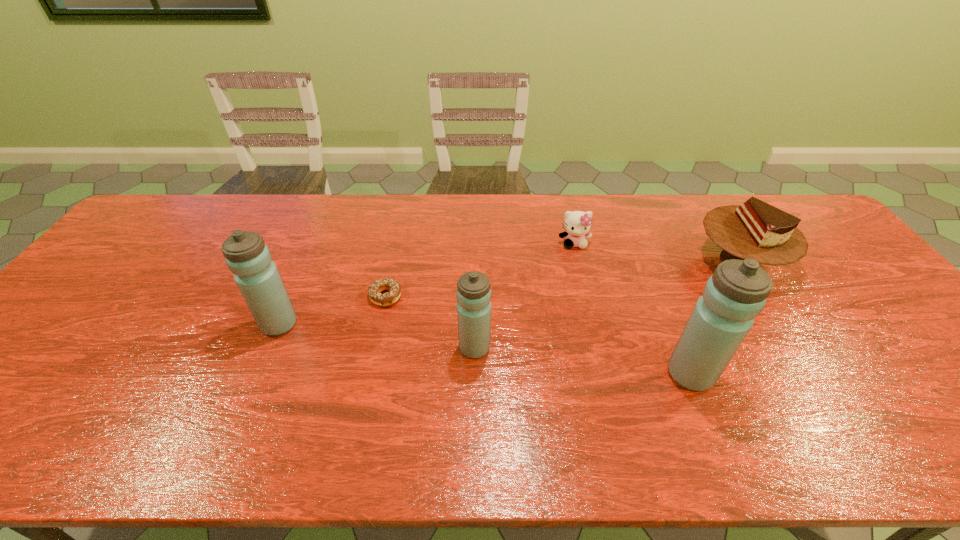
Locate an element on the screen. free space at the far edge is located at coordinates (255, 227).

Where is `free location at the near edge of the desktop`? free location at the near edge of the desktop is located at coordinates (603, 396).

Locate an element on the screen. This screenshot has height=540, width=960. free region at the left edge of the desktop is located at coordinates (114, 307).

Where is `free space at the right edge of the desktop`? This screenshot has width=960, height=540. free space at the right edge of the desktop is located at coordinates (886, 303).

Locate an element on the screen. vacant space at the far left corner of the desktop is located at coordinates (138, 228).

You are a GUI agent. You are given a task and a screenshot of the screen. Output one action in this format:
    pyautogui.click(x=<x>, y=<y>)
    Task: Click on the unoccupied position between the kitten and the third tallest object
    The image size is (960, 540).
    Given the screenshot: What is the action you would take?
    pyautogui.click(x=524, y=295)

The image size is (960, 540). Find the location of `free area in between the leftmost water bottle and the fourth object from right to left`. free area in between the leftmost water bottle and the fourth object from right to left is located at coordinates [377, 336].

The image size is (960, 540). What are the coordinates of `empty space between the rightmost object and the fourth object from left to right` in the screenshot? It's located at (657, 252).

Locate an element on the screen. This screenshot has width=960, height=540. free point between the cake and the shortest water bottle is located at coordinates (607, 304).

At what (x,y) coordinates should I click in order to perform the action: click on vacant space that's between the third shortest object and the doughnut. Please return your answer as a coordinate pair (x, y). This screenshot has width=960, height=540. Looking at the image, I should click on (563, 278).